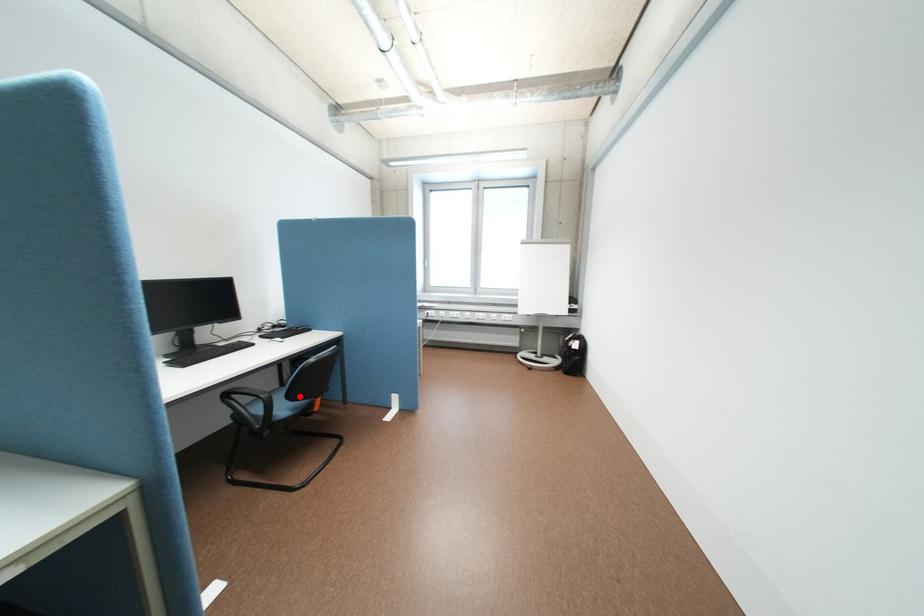
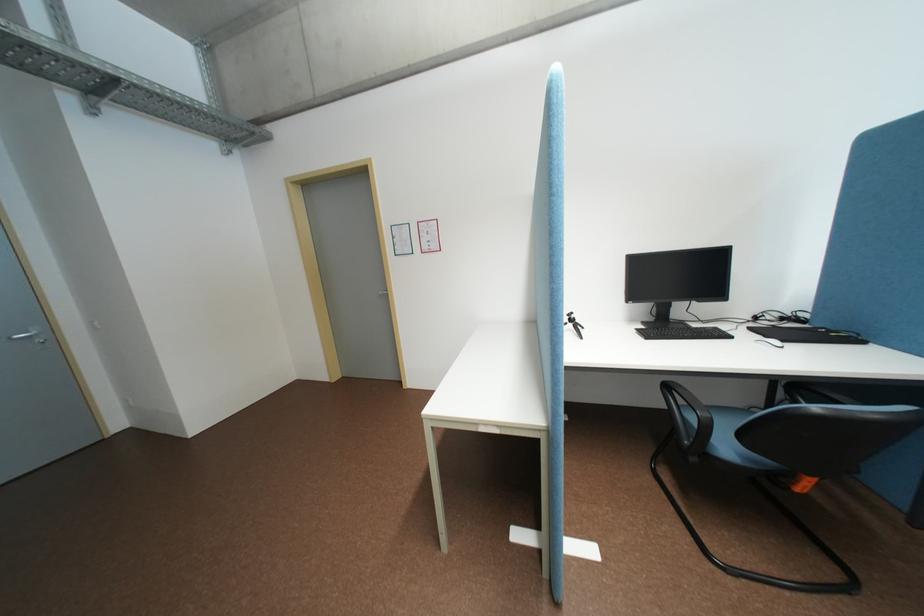
Question: I am providing you with two images of the same scene from different viewpoints. A red point is shown in image1. For the corresponding object point in image2, is it positioned nearer or farther from the camera?

Choices:
 (A) Nearer
 (B) Farther

Answer: (B)